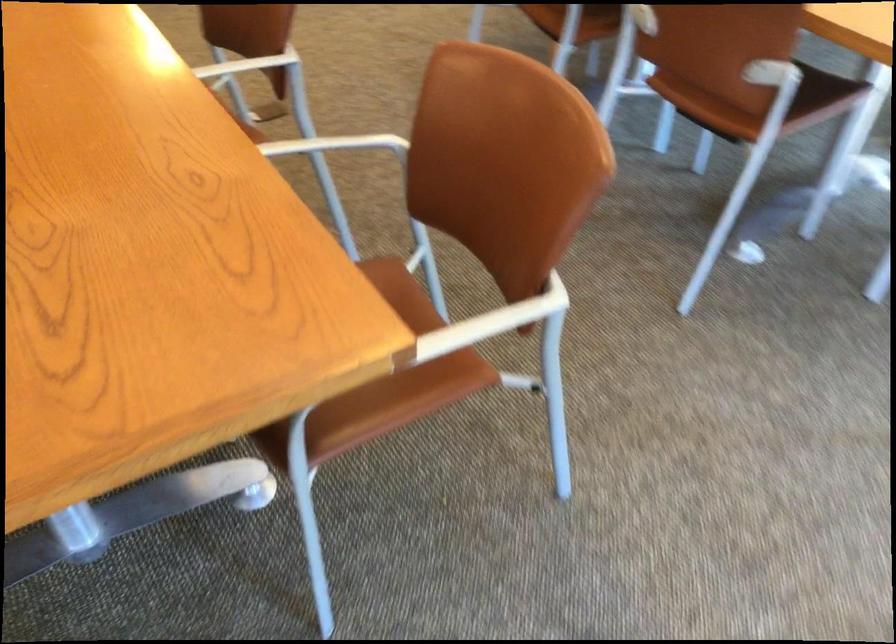
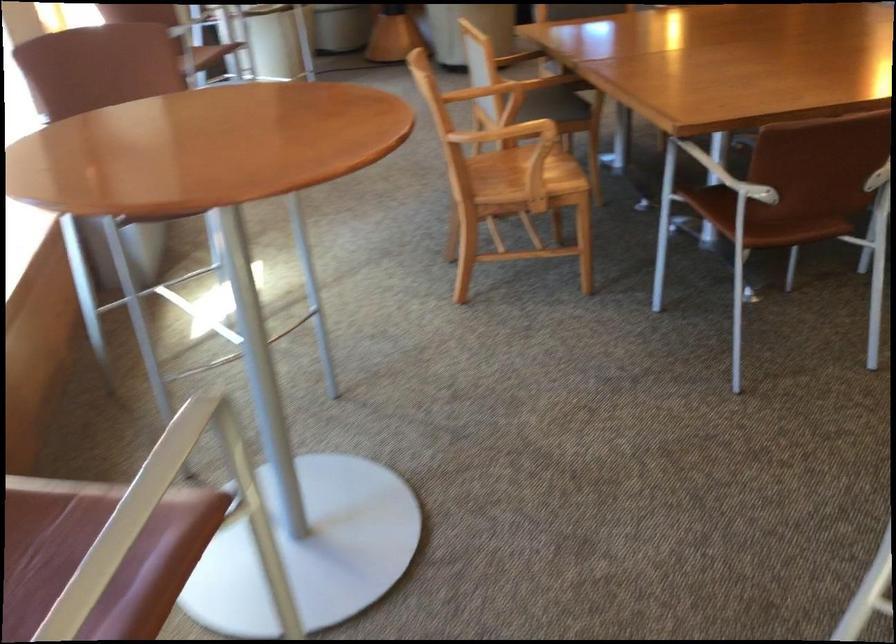
The point at (222, 232) is marked in the first image. Where is the corresponding point in the second image?

(728, 176)